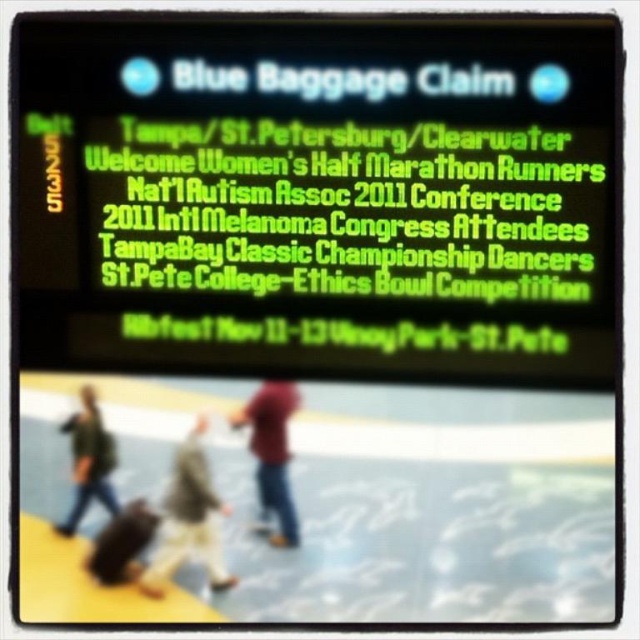
You are at the airport and need to find the Blue Baggage Claim. You see a green neon sign at upper center and a light beige fabric jacket at center. Which object is larger?

The green neon sign at upper center is bigger than the light beige fabric jacket at center according to the description.

You are standing in the airport baggage claim area and see the green neon sign at upper center and the light beige fabric jacket at center. Which object is positioned more to the left?

The light beige fabric jacket at center is positioned more to the left than the green neon sign at upper center.